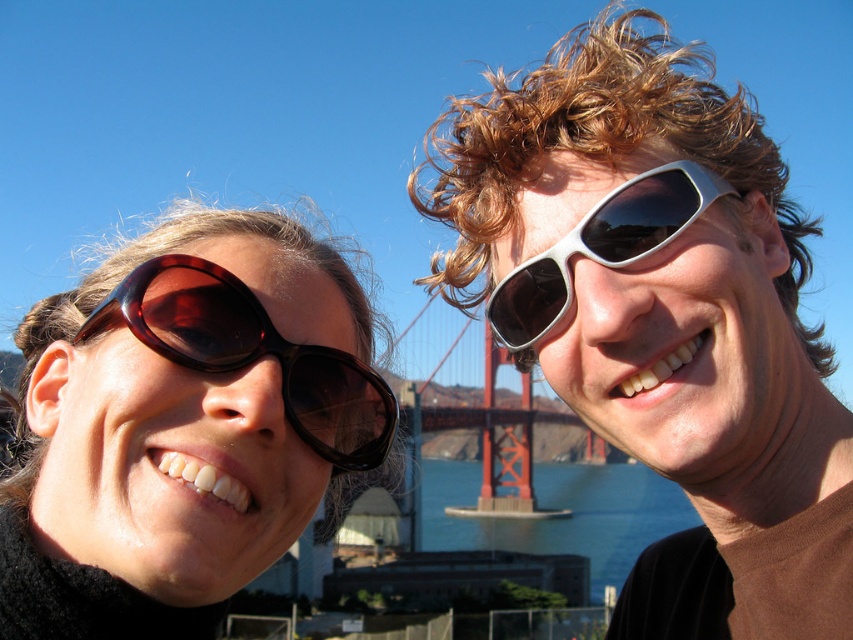
Question: Which point is farther to the camera?

Choices:
 (A) (547, 284)
 (B) (824, 570)
 (C) (503, 538)

Answer: (C)

Question: Which point is closer to the camera?

Choices:
 (A) brown glossy sunglasses at left
 (B) blue water at center
 (C) silver reflective sunglasses at upper right

Answer: (C)

Question: Does brown glossy sunglasses at left appear under metallic silver sunglasses at upper right?

Choices:
 (A) yes
 (B) no

Answer: (A)

Question: Is brown glossy sunglasses at left above metallic silver sunglasses at upper right?

Choices:
 (A) no
 (B) yes

Answer: (A)

Question: Is tortoiseshell sunglasses at upper left to the left of metallic silver sunglasses at upper right from the viewer's perspective?

Choices:
 (A) yes
 (B) no

Answer: (A)

Question: Which object appears farthest from the camera in this image?

Choices:
 (A) silver reflective sunglasses at upper right
 (B) metallic silver sunglasses at upper right

Answer: (B)